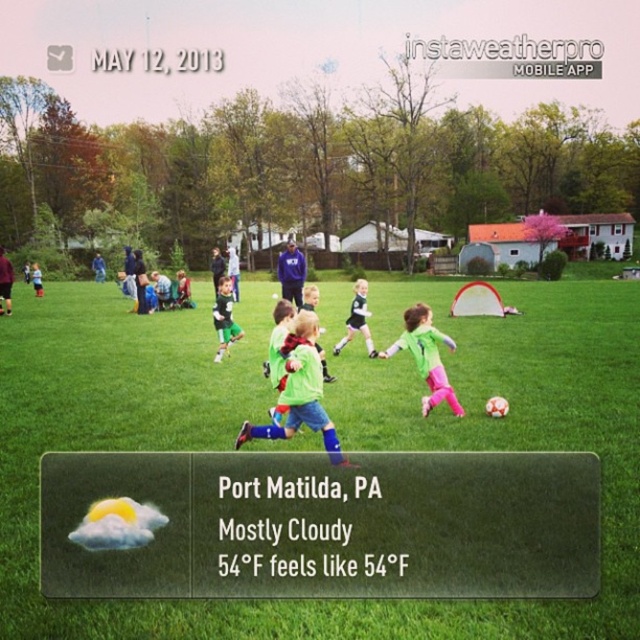
You are a photographer trying to capture a shot of both the green matte soccer jersey at center and the green jersey at center. Which one appears taller in the photo?

The green matte soccer jersey at center is taller than the green jersey at center, so it will appear taller in the photo.

You are a soccer player standing at the center of the field. You notice a point marked at coordinates (339,433). What is the color of the grass at that point?

The green grass at center is represented by point (339,433), so the color of the grass at that point is green.